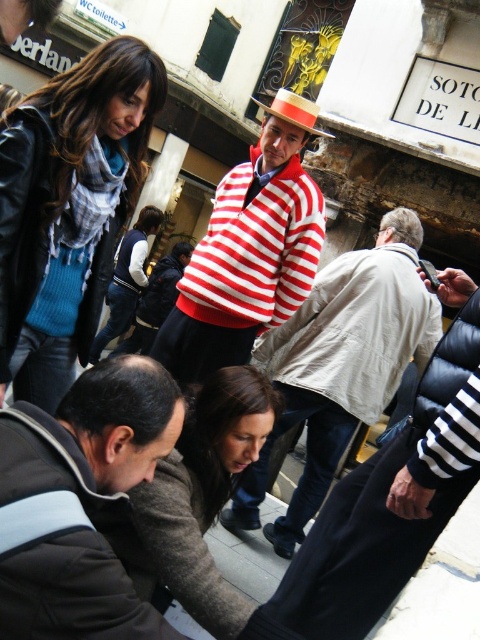
Based on the photo, you are a tailor observing two sweaters in the scene. The blue knit sweater at upper left and the striped cotton sweater at center. Which one is narrower in width?

The blue knit sweater at upper left has a lesser width compared to striped cotton sweater at center, so it is narrower.